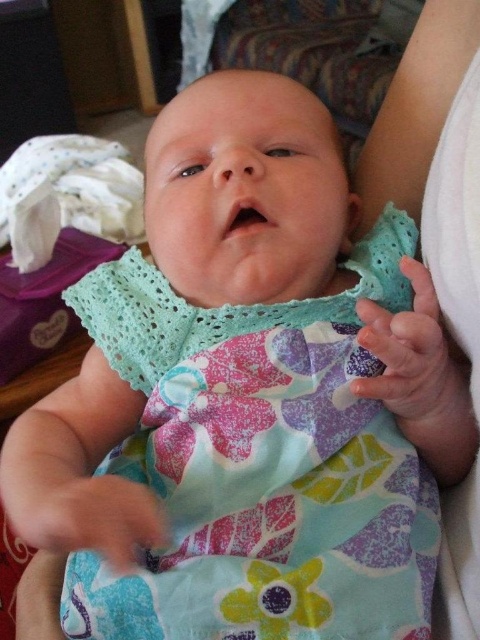
Does white fabric at center have a greater width compared to white soft cloth at left?

No.

Is point (395, 172) farther from viewer compared to point (59, 157)?

No, it is in front of (59, 157).

Between point (429, 76) and point (24, 264), which one is positioned behind?

Positioned behind is point (24, 264).

This screenshot has height=640, width=480. I want to click on white fabric at center, so click(435, 160).